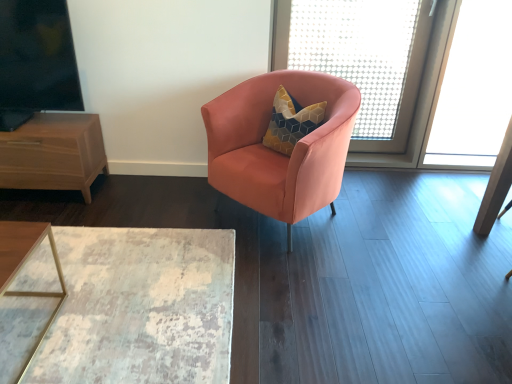
Identify the location of vacant area that lies to the right of distressed wood table at lower left. Image resolution: width=512 pixels, height=384 pixels. (331, 284).